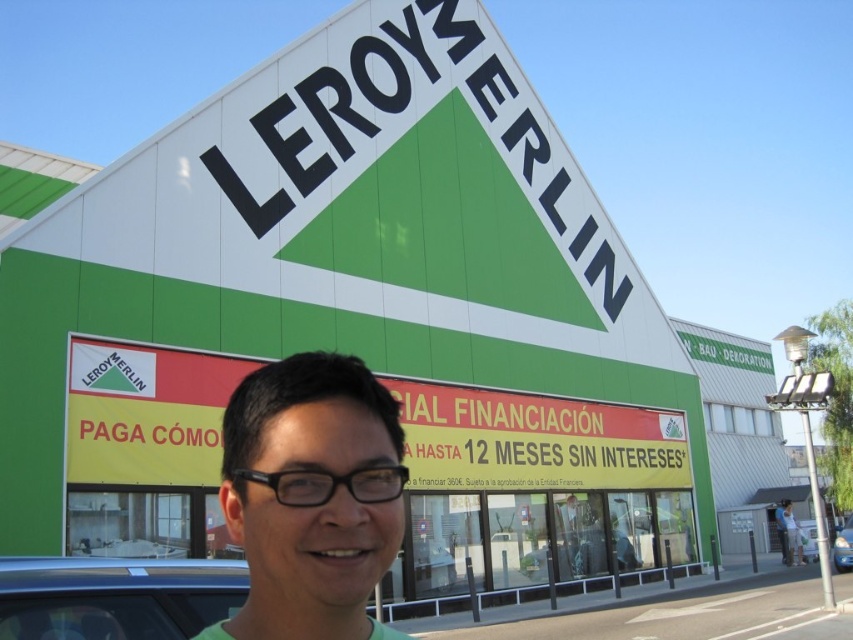
You are a delivery driver who needs to park your metallic silver car at center close to the person wearing matte black glasses at center. The parking spot you choose must be within 5 meters of them. Can you park your car in the available spot and still be within the required distance?

The matte black glasses at center and metallic silver car at center are 8.87 meters apart, so no, the driver cannot park the metallic silver car at center within 5 meters of the person wearing matte black glasses at center since the distance is greater than the allowed limit.

You are a photographer taking a picture of the Leroy Merlin store. You notice the green matte shirt at center and the metallic silver car at lower left. Which object is located to the right of the other?

The green matte shirt at center is positioned on the right side of metallic silver car at lower left.